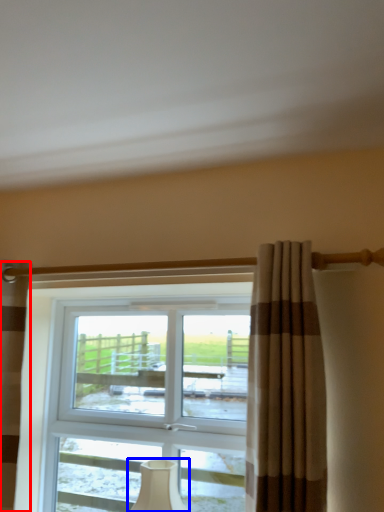
Question: Which object is further to the camera taking this photo, curtain (highlighted by a red box) or table lamp (highlighted by a blue box)?

Choices:
 (A) curtain
 (B) table lamp

Answer: (B)